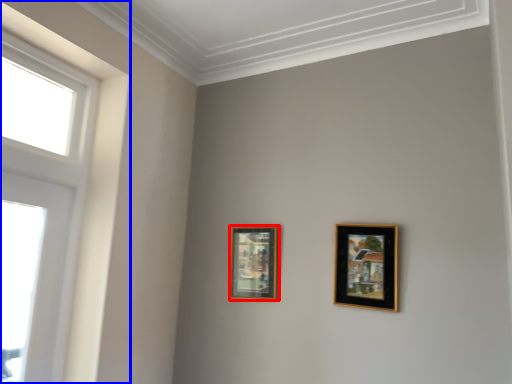
Question: Which object appears farthest to the camera in this image, picture frame (highlighted by a red box) or window (highlighted by a blue box)?

Choices:
 (A) picture frame
 (B) window

Answer: (A)